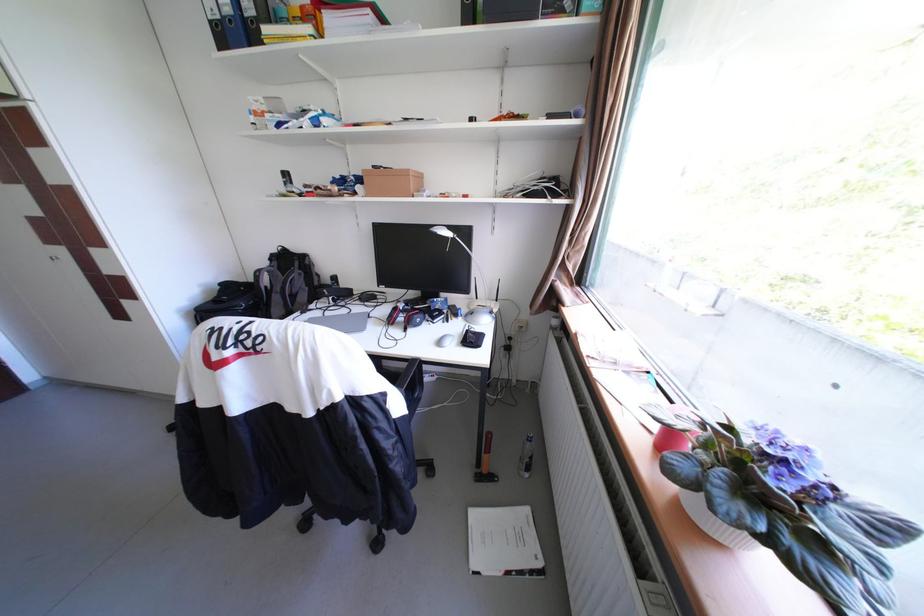
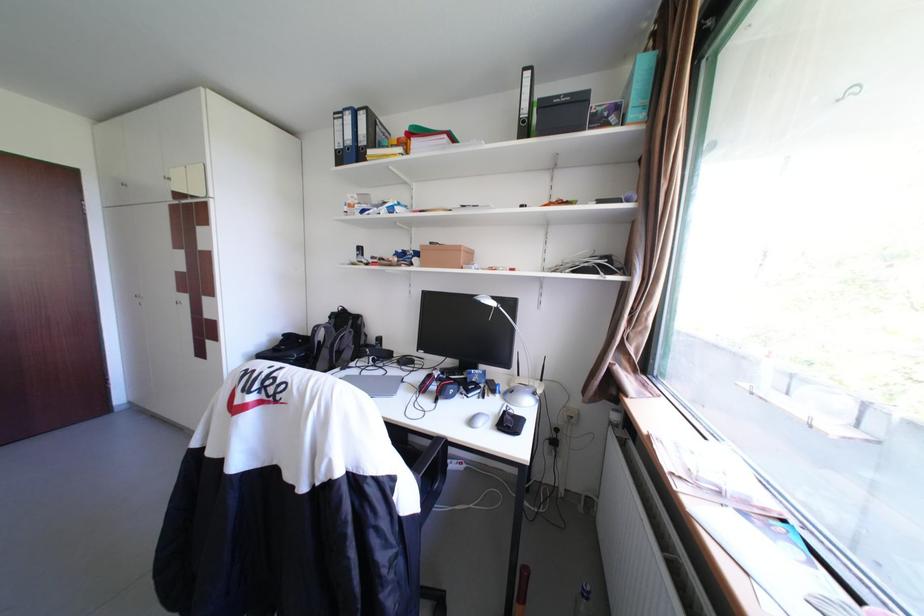
Question: I am providing you with two images of the same scene from different viewpoints. Please identify which objects are invisible in image2.

Choices:
 (A) white computer mouse
 (B) blue ring binder
 (C) desk lamp head
 (D) none of these

Answer: (D)